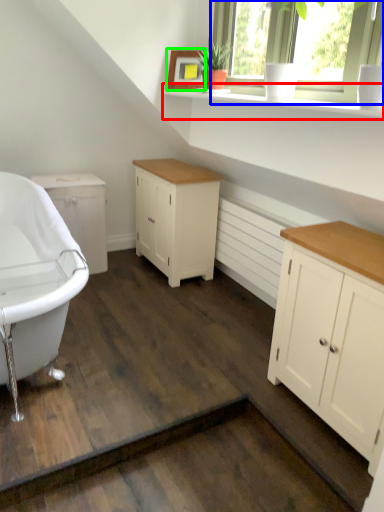
Question: Which object is the closest to the window sill (highlighted by a red box)? Choose among these: window (highlighted by a blue box) or picture frame (highlighted by a green box).

Choices:
 (A) window
 (B) picture frame

Answer: (A)